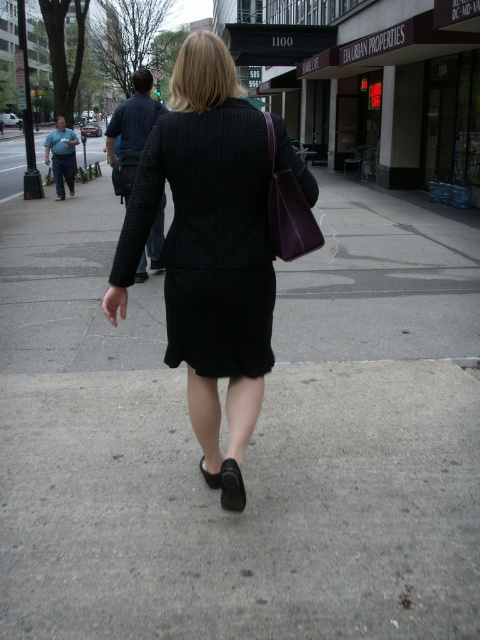
Which is more to the left, matte black skirt at center or black textured blazer at upper center?

Positioned to the left is black textured blazer at upper center.

Who is lower down, matte black skirt at center or black textured blazer at upper center?

matte black skirt at center is lower down.

Which is in front, point (255, 212) or point (146, 122)?

Point (255, 212)

In order to click on matte black skirt at center in this screenshot , I will do `click(208, 250)`.